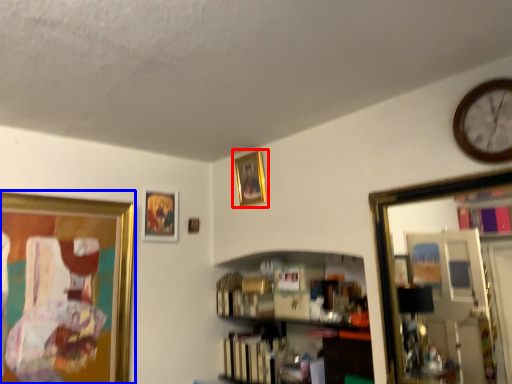
Question: Which object is further to the camera taking this photo, picture frame (highlighted by a red box) or picture frame (highlighted by a blue box)?

Choices:
 (A) picture frame
 (B) picture frame

Answer: (A)